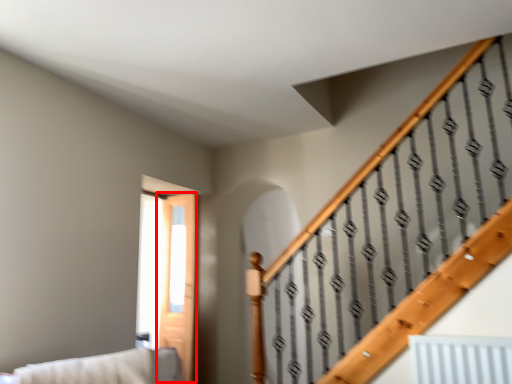
Question: From the image's perspective, what is the correct spatial positioning of screen door (annotated by the red box) in reference to couch?

Choices:
 (A) above
 (B) below

Answer: (B)